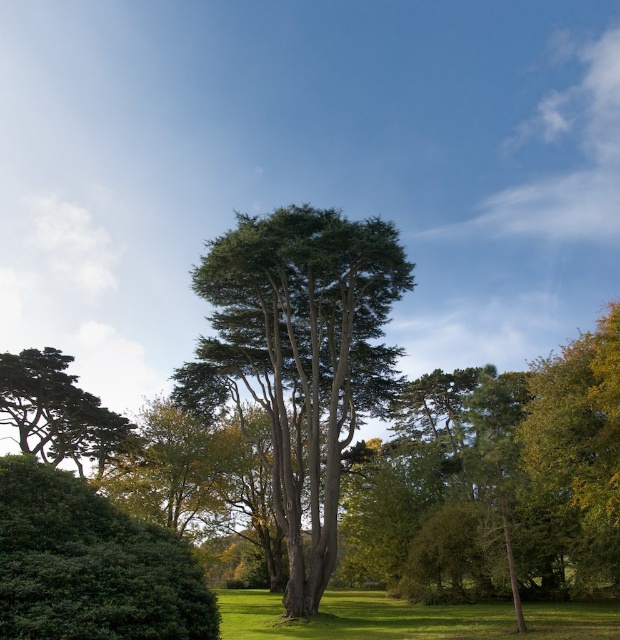
Between green leafy hedge at lower left and green grassy field at lower center, which one appears on the left side from the viewer's perspective?

green leafy hedge at lower left

How much distance is there between green leafy hedge at lower left and green grassy field at lower center?

green leafy hedge at lower left is 11.81 meters away from green grassy field at lower center.

Who is more forward, (x=86, y=627) or (x=427, y=612)?

Point (x=86, y=627)

Locate an element on the screen. This screenshot has height=640, width=620. green leafy hedge at lower left is located at coordinates (91, 564).

Between green leafy tree at center and green leafy hedge at lower left, which one appears on the right side from the viewer's perspective?

From the viewer's perspective, green leafy tree at center appears more on the right side.

Which is behind, point (342, 220) or point (29, 541)?

The point (342, 220) is behind.

This screenshot has height=640, width=620. In order to click on green leafy tree at center in this screenshot , I will do `click(301, 356)`.

The height and width of the screenshot is (640, 620). What do you see at coordinates (91, 564) in the screenshot? I see `green leafy hedge at lower left` at bounding box center [91, 564].

Is green leafy hedge at lower left to the right of green textured tree at lower left from the viewer's perspective?

Yes, green leafy hedge at lower left is to the right of green textured tree at lower left.

Find the location of a particular element. This screenshot has height=640, width=620. green leafy hedge at lower left is located at coordinates (91, 564).